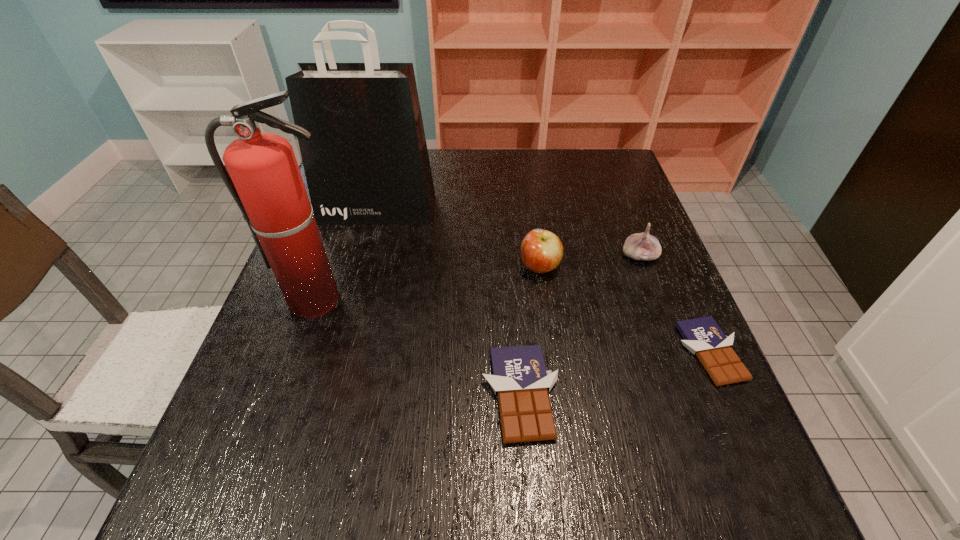
The height and width of the screenshot is (540, 960). Find the location of `vacant point located between the apple and the garlic`. vacant point located between the apple and the garlic is located at coordinates (589, 262).

Identify the location of empty space between the fire extinguisher and the apple. (428, 284).

Identify the location of free space that is in between the left chocolate bar and the apple. (530, 331).

The height and width of the screenshot is (540, 960). I want to click on free space between the apple and the shortest object, so click(624, 310).

Point out which object is positioned as the fifth nearest to the shopping bag. Please provide its 2D coordinates. Your answer should be formatted as a tuple, i.e. [(x, y)], where the tuple contains the x and y coordinates of a point satisfying the conditions above.

[(703, 337)]

Locate which object is the third closest to the right chocolate bar. Please provide its 2D coordinates. Your answer should be formatted as a tuple, i.e. [(x, y)], where the tuple contains the x and y coordinates of a point satisfying the conditions above.

[(520, 379)]

Find the location of `vacant space that satisfies the following two spatial constraints: 1. on the front with handles of the garlic; 2. on the left side of the farthest object`. vacant space that satisfies the following two spatial constraints: 1. on the front with handles of the garlic; 2. on the left side of the farthest object is located at coordinates 365,256.

I want to click on free space that satisfies the following two spatial constraints: 1. on the back side of the garlic; 2. on the right side of the taller chocolate bar, so click(x=511, y=256).

Find the location of a particular element. free location that satisfies the following two spatial constraints: 1. with the nozzle and gauge on the shorter chocolate bar; 2. on the left side of the fire extinguisher is located at coordinates pos(298,353).

This screenshot has width=960, height=540. In order to click on vacant space that satisfies the following two spatial constraints: 1. on the back side of the fifth tallest object; 2. on the left side of the shortest object in this screenshot , I will do `click(517, 353)`.